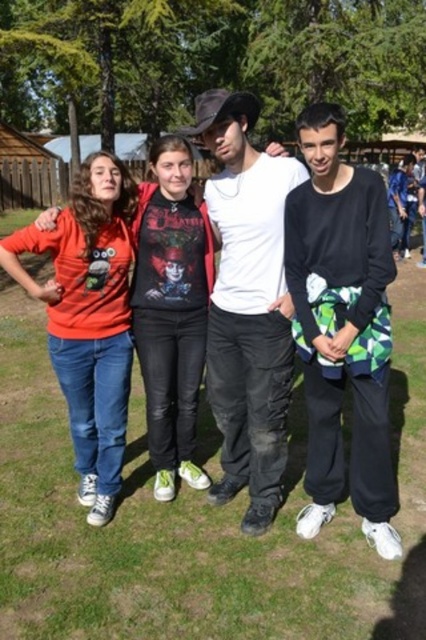
Question: Does green grass at lower center appear under matte black shirt at upper right?

Choices:
 (A) no
 (B) yes

Answer: (B)

Question: Which point is farther from the camera taking this photo?

Choices:
 (A) (322, 410)
 (B) (198, 394)
 (C) (238, 177)

Answer: (B)

Question: Can you confirm if matte red t-shirt at left is positioned to the left of matte red hoodie at center?

Choices:
 (A) yes
 (B) no

Answer: (A)

Question: From the image, what is the correct spatial relationship of matte red hoodie at center in relation to matte black shirt at upper right?

Choices:
 (A) below
 (B) above

Answer: (A)

Question: Which point appears farthest from the camera in this image?

Choices:
 (A) (256, 216)
 (B) (391, 237)

Answer: (B)

Question: Which point is closer to the camera?

Choices:
 (A) black matte pants at right
 (B) matte red t-shirt at left

Answer: (A)